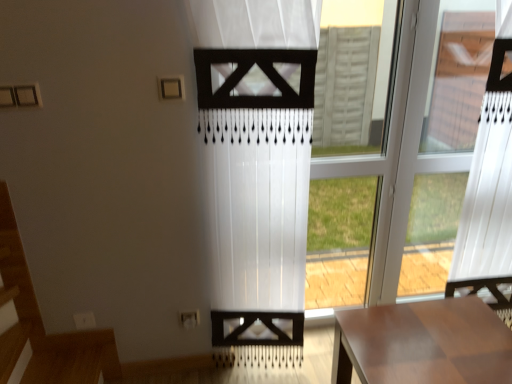
Find the location of a particular element. Image resolution: width=512 pixels, height=384 pixels. vacant region above white sheer curtain at center (from a real-world perspective) is located at coordinates (239, 0).